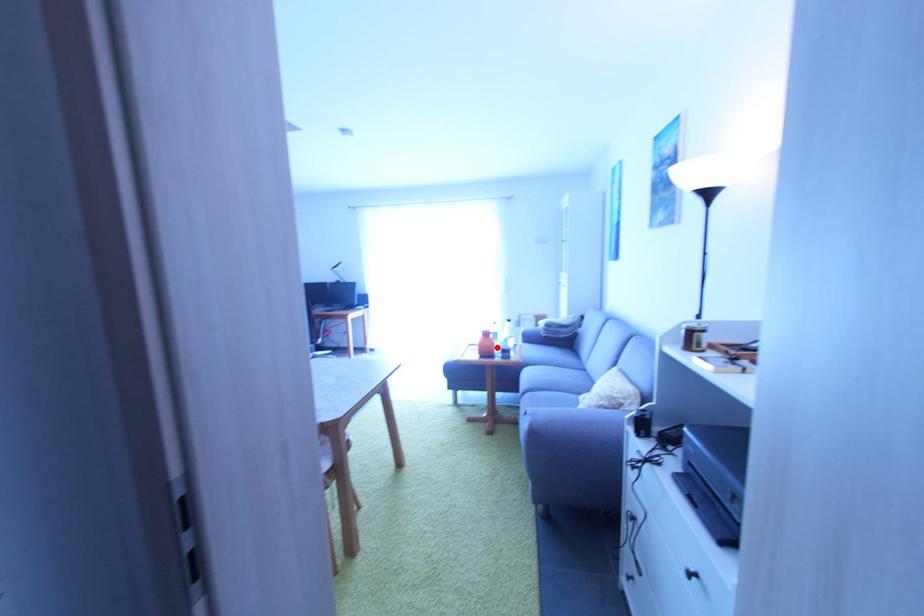
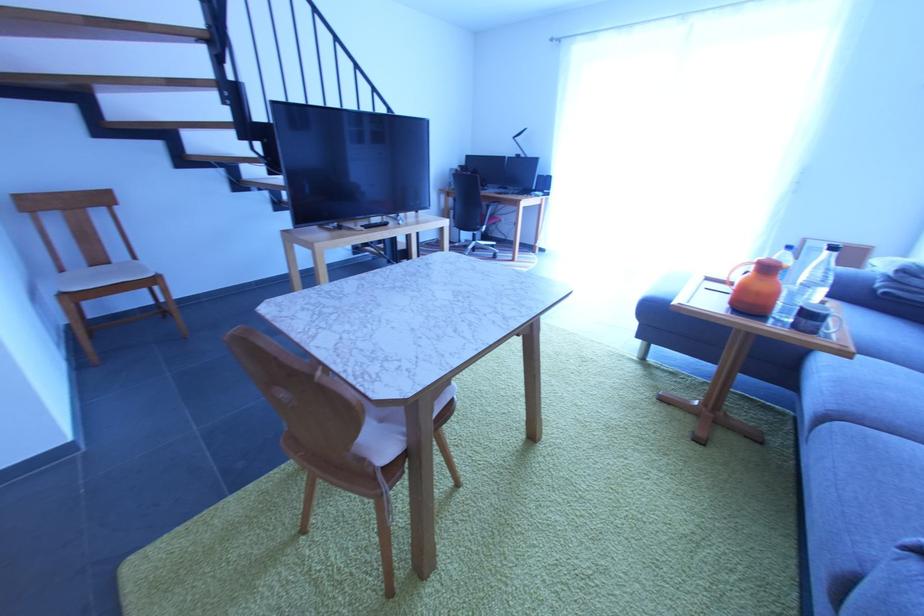
Where in the second image is the point corresponding to the highlighted location from the first image?

(779, 297)